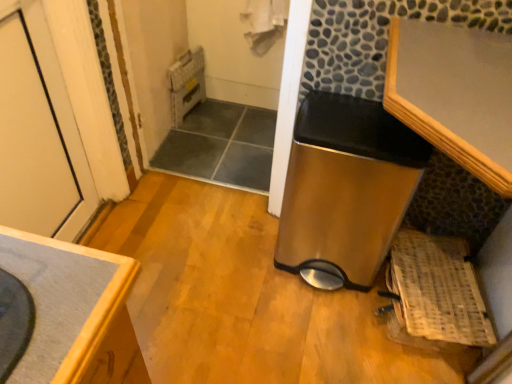
The height and width of the screenshot is (384, 512). I want to click on free region on the left part of woven wood basket at lower right, so click(314, 324).